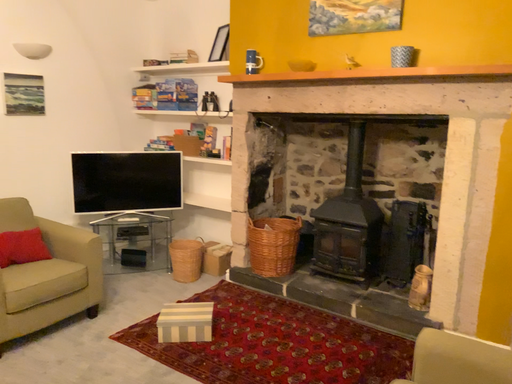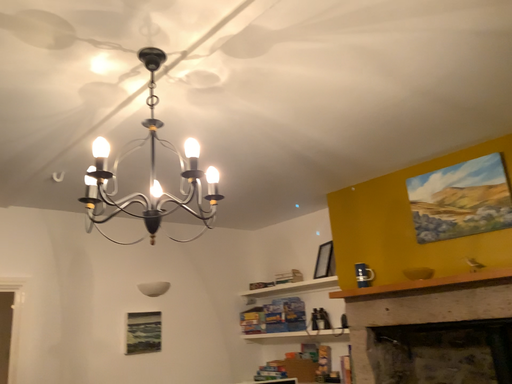
Question: How did the camera likely rotate when shooting the video?

Choices:
 (A) rotated left
 (B) rotated right

Answer: (A)